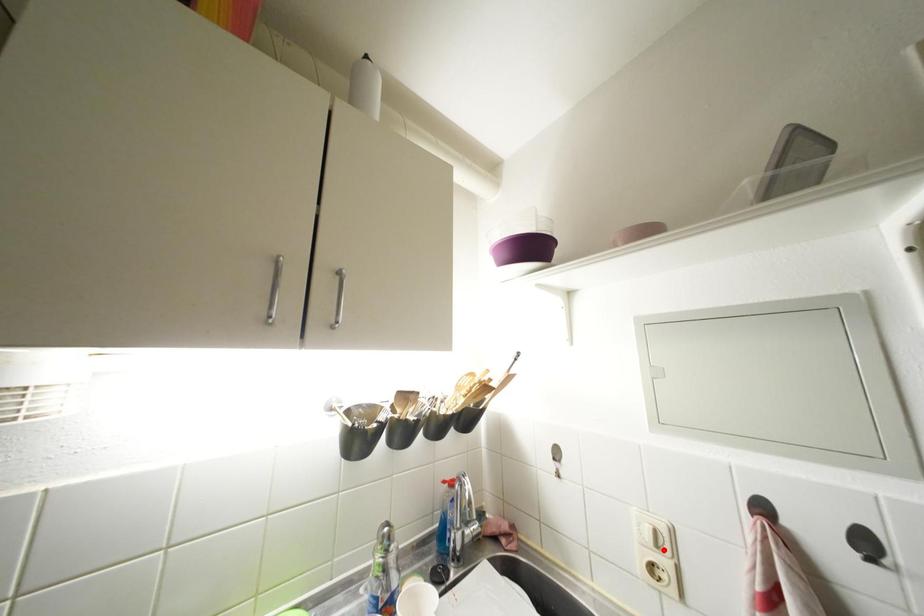
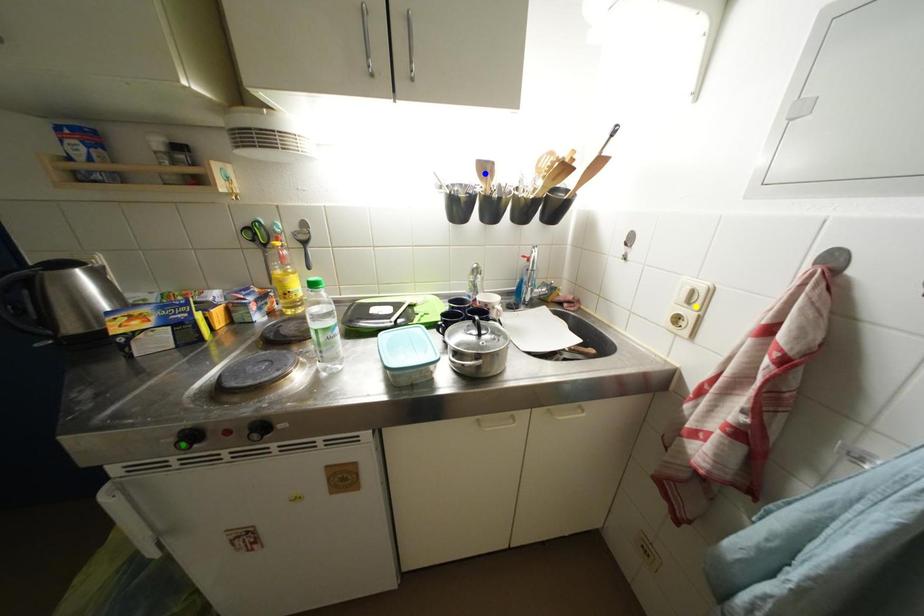
Question: I am providing you with two images of the same scene from different viewpoints. A red point is marked on the first image. You are given multiple points on the second image. Which point in image 2 represents the same 3d spot as the red point in image 1?

Choices:
 (A) green point
 (B) blue point
 (C) yellow point

Answer: (C)